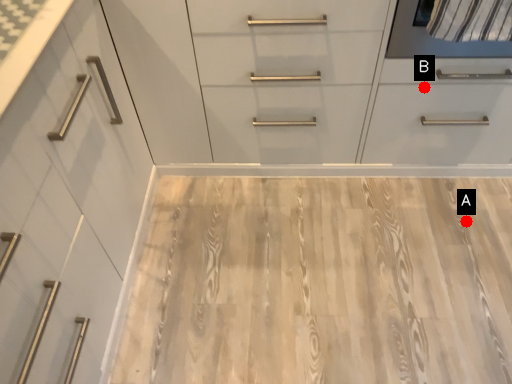
Question: Two points are circled on the image, labeled by A and B beside each circle. Which point is farther to the camera?

Choices:
 (A) A is further
 (B) B is further

Answer: (A)